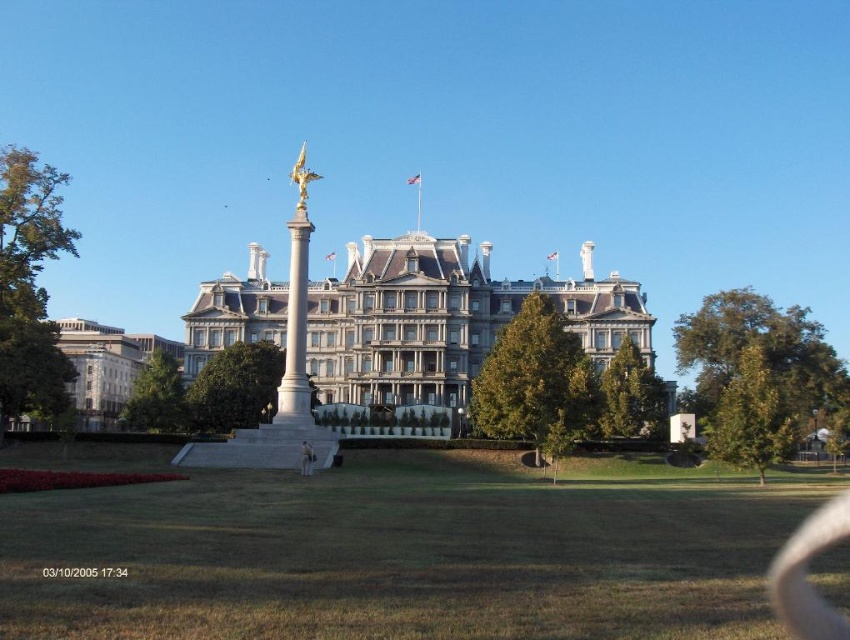
You are standing at the point closest to the building. Which of the two points, point (434,513) or point (302,417), is closer to you?

Point (302,417) is closer to you since it is behind point (434,513), which is in front of it.

You are a tourist visiting the historic site and want to take a photo of both the white stone palace at center and the white marble column at center. Which object should you focus on first to ensure both are in frame without moving the camera?

You should focus on the white stone palace at center first because it is shorter than the white marble column at center, so positioning the camera to include the taller column will naturally include the shorter palace in the frame.

In the scene shown: You are standing in front of the grand historic building and want to place a small flower pot exactly where the green grass at center is located. What are the coordinates of the point where you should place the flower pot?

The coordinates for the green grass at center are at point (400, 556), so you should place the flower pot at those coordinates.